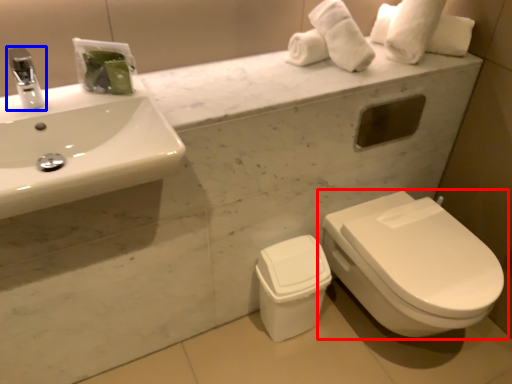
Question: Which object appears farthest to the camera in this image, toilet (highlighted by a red box) or tap (highlighted by a blue box)?

Choices:
 (A) toilet
 (B) tap

Answer: (A)